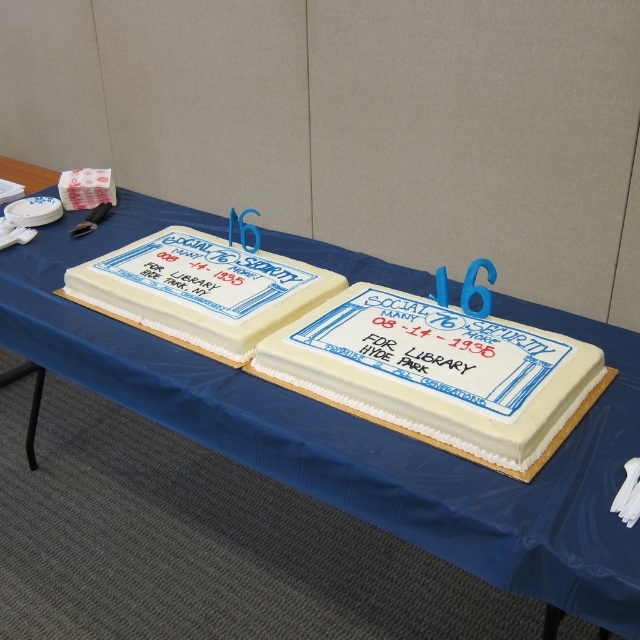
You are a guest at a Social Security event and want to take a photo of both the white frosted cake at center and the white fondant cake at left. If you stand directly in front of the table, which cake should you focus on first to ensure both are in the frame?

The white fondant cake at left should be focused on first because it is above the white frosted cake at center, so adjusting the camera angle to include the upper cake ensures both are visible.

You are at a historical exhibit about Social Security and see two cakes displayed on a table. The cakes are labeled as white frosted cake at center and white fondant cake at left. Based on their positions, which cake is closer to the right edge of the table?

The white frosted cake at center is closer to the right edge of the table because it is positioned to the right of the white fondant cake at left.

Based on the photo, you are a baker who needs to place both cakes on a 30 cm wide shelf. The white frosted cake at center and the white fondant cake at left are both in front of you. Can you fit both cakes side by side on the shelf without overlapping?

The white frosted cake at center might be wider than white fondant cake at left, so it is uncertain if both can fit on the 30 cm shelf. Measure their combined widths to confirm.